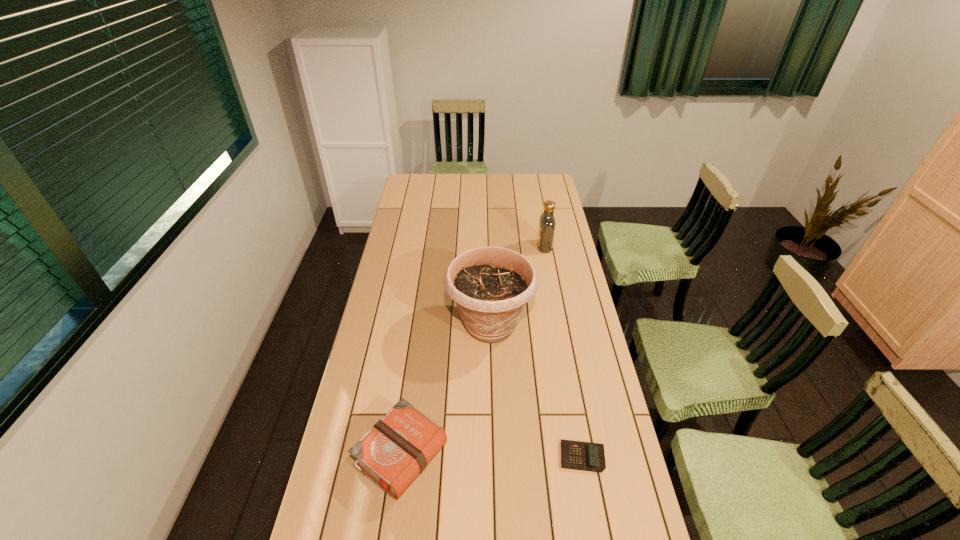
Locate an element on the screen. This screenshot has height=540, width=960. the third nearest object is located at coordinates (490, 285).

Locate an element on the screen. The image size is (960, 540). the farthest object is located at coordinates (546, 230).

The height and width of the screenshot is (540, 960). In order to click on the second shortest object in this screenshot , I will do `click(397, 449)`.

You are a GUI agent. You are given a task and a screenshot of the screen. Output one action in this format:
    pyautogui.click(x=<x>, y=<y>)
    Task: Click on the shortest object
    This screenshot has height=540, width=960.
    Given the screenshot: What is the action you would take?
    pyautogui.click(x=586, y=456)

Find the location of a particular element. blank space located 0.160m on the right of the second farthest object is located at coordinates (576, 325).

Where is `vacant space located 0.120m on the front-facing side of the vodka`? The width and height of the screenshot is (960, 540). vacant space located 0.120m on the front-facing side of the vodka is located at coordinates (511, 247).

This screenshot has height=540, width=960. I want to click on vacant region located on the front-facing side of the vodka, so click(x=511, y=247).

The width and height of the screenshot is (960, 540). I want to click on free spot located 0.170m on the front-facing side of the vodka, so click(500, 247).

Where is `vacant space located on the right of the Bible`? The image size is (960, 540). vacant space located on the right of the Bible is located at coordinates (548, 455).

Locate an element on the screen. This screenshot has width=960, height=540. vacant space located 0.110m on the left of the calculator is located at coordinates (520, 457).